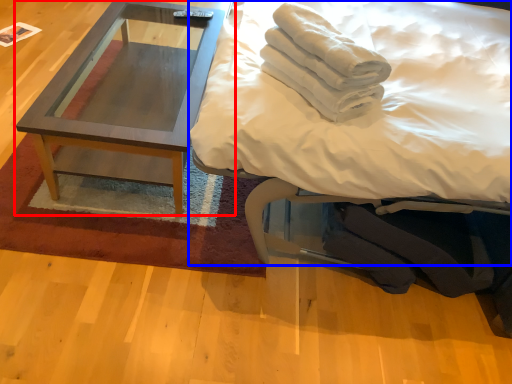
Question: Which of the following is the closest to the observer, coffee table (highlighted by a red box) or bed (highlighted by a blue box)?

Choices:
 (A) coffee table
 (B) bed

Answer: (B)